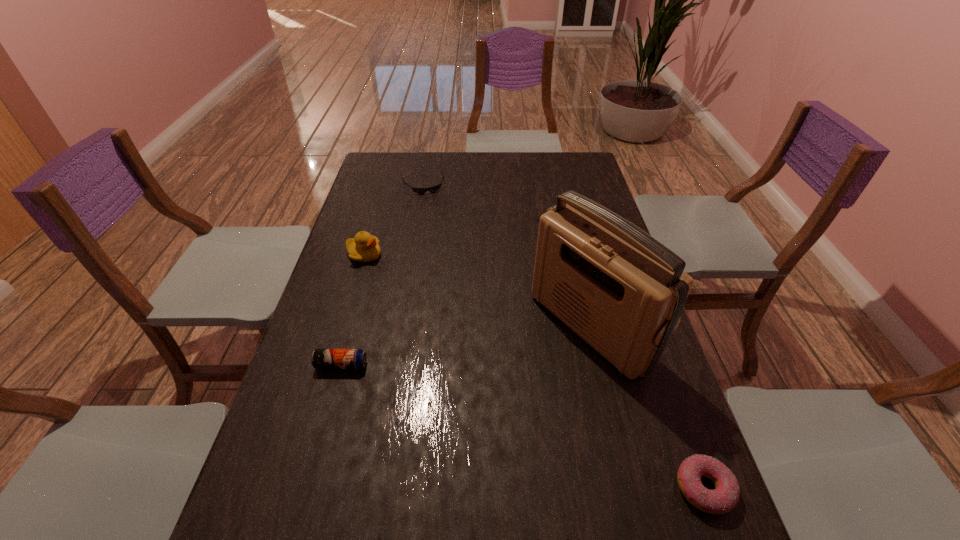
Identify the location of vacant space on the desktop that is between the beer can and the nearest object and is positioned on the front-facing side of the fourth nearest object. (482, 413).

The height and width of the screenshot is (540, 960). In order to click on free space on the desktop that is between the beer can and the nearest object and is positioned on the front-facing side of the radio receiver in this screenshot , I will do `click(469, 408)`.

Find the location of a particular element. vacant space on the desktop that is between the beer can and the doughnut and is positioned on the front-facing side of the sunglasses is located at coordinates (507, 421).